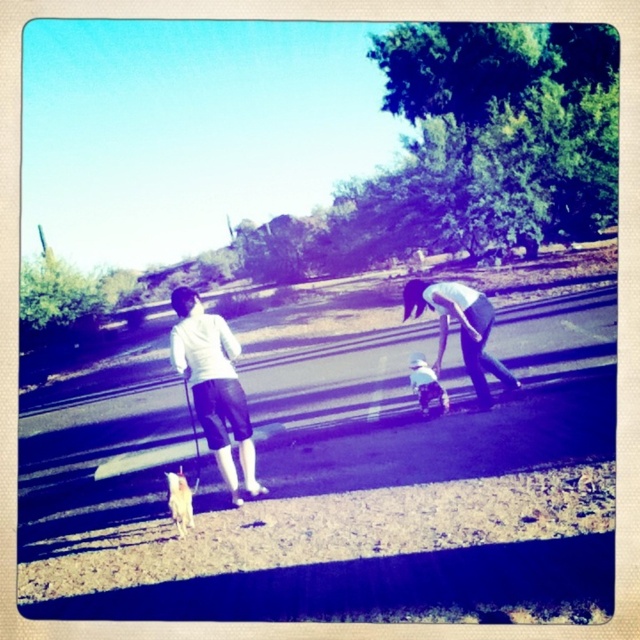
Question: Which object is farther from the camera taking this photo?

Choices:
 (A) light blue denim jeans at center
 (B) white fur dog at lower left
 (C) white matte shorts at left

Answer: (A)

Question: Can you confirm if white matte shorts at left is positioned to the right of light blue denim jeans at center?

Choices:
 (A) yes
 (B) no

Answer: (B)

Question: Which point is closer to the camera taking this photo?

Choices:
 (A) (438, 314)
 (B) (173, 362)
 (C) (413, 387)
 (D) (177, 497)

Answer: (D)

Question: Can you confirm if light blue denim jeans at center is positioned to the left of white fur dog at lower left?

Choices:
 (A) yes
 (B) no

Answer: (B)

Question: Estimate the real-world distances between objects in this image. Which object is farther from the white cotton shirt at lower center?

Choices:
 (A) white matte shorts at left
 (B) white fur dog at lower left

Answer: (B)

Question: Where is light blue denim jeans at center located in relation to white cotton shirt at lower center in the image?

Choices:
 (A) below
 (B) above

Answer: (B)